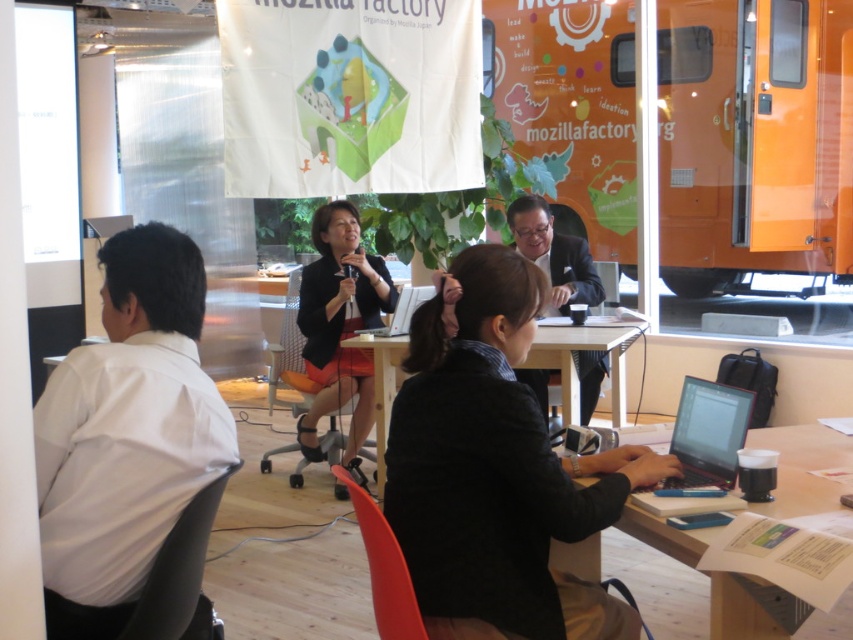
Is black fabric jacket at center to the right of white smooth shirt at left from the viewer's perspective?

Correct, you'll find black fabric jacket at center to the right of white smooth shirt at left.

Is black fabric jacket at center above white smooth shirt at left?

No, black fabric jacket at center is not above white smooth shirt at left.

Which is behind, point (418, 536) or point (132, 435)?

Point (418, 536)

The height and width of the screenshot is (640, 853). What are the coordinates of `black fabric jacket at center` in the screenshot? It's located at (496, 468).

Can you confirm if dark suit at center is shorter than silver metallic laptop at center?

No.

Between point (590, 298) and point (393, 332), which one is positioned behind?

Point (590, 298)

This screenshot has width=853, height=640. I want to click on dark suit at center, so click(x=554, y=253).

Can you confirm if black fabric jacket at center is taller than dark suit at center?

Yes, black fabric jacket at center is taller than dark suit at center.

Between black fabric jacket at center and dark suit at center, which one has more height?

black fabric jacket at center is taller.

Which is in front, point (544, 604) or point (578, 292)?

Point (544, 604) is in front.

Locate an element on the screen. This screenshot has width=853, height=640. black fabric jacket at center is located at coordinates (496, 468).